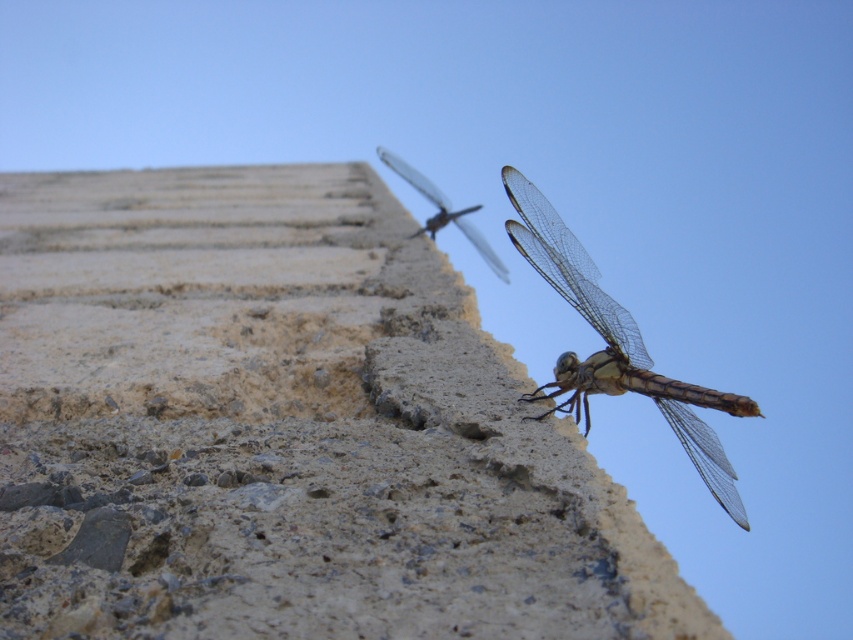
Question: Is translucent brown dragonfly at upper right bigger than translucent winged insect at upper center?

Choices:
 (A) no
 (B) yes

Answer: (A)

Question: Which is farther from the translucent winged insect at upper center?

Choices:
 (A) translucent brown dragonfly at upper right
 (B) rough concrete wall at center

Answer: (A)

Question: Which point is farther from the camera taking this photo?

Choices:
 (A) (438, 212)
 (B) (564, 358)

Answer: (A)

Question: Is rough concrete wall at center bigger than translucent winged insect at upper center?

Choices:
 (A) no
 (B) yes

Answer: (B)

Question: Is rough concrete wall at center thinner than translucent winged insect at upper center?

Choices:
 (A) no
 (B) yes

Answer: (A)

Question: Which point is closer to the camera?

Choices:
 (A) (587, 428)
 (B) (490, 257)

Answer: (A)